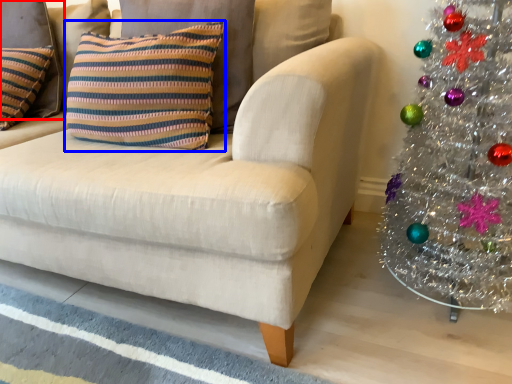
Question: Which object appears farthest to the camera in this image, pillow (highlighted by a red box) or pillow (highlighted by a blue box)?

Choices:
 (A) pillow
 (B) pillow

Answer: (A)